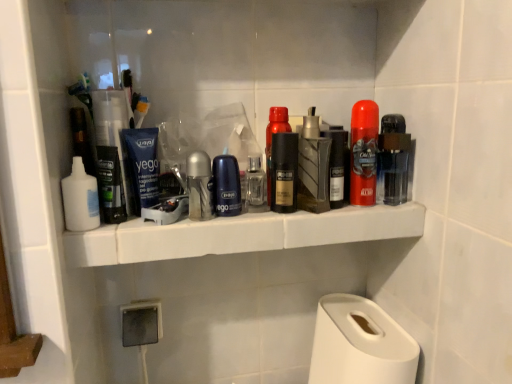
Question: Which direction should I rotate to look at clear glass spray bottle at center, acting as the 2th toiletry starting from the right?

Choices:
 (A) right
 (B) left

Answer: (A)

Question: Can you confirm if shiny red can at center, which is counted as the 7th personal care, starting from the left, is taller than white matte lotion at left, acting as the first toiletry starting from the left?

Choices:
 (A) no
 (B) yes

Answer: (B)

Question: Does shiny red can at center, the second personal care in the right-to-left sequence, have a smaller size compared to white matte lotion at left, acting as the first toiletry starting from the left?

Choices:
 (A) yes
 (B) no

Answer: (B)

Question: Is shiny red can at center, which is counted as the 7th personal care, starting from the left, located outside white matte lotion at left, the fourth toiletry positioned from the right?

Choices:
 (A) no
 (B) yes

Answer: (B)

Question: Does shiny red can at center, the second personal care in the right-to-left sequence, have a greater width compared to white matte lotion at left, acting as the first toiletry starting from the left?

Choices:
 (A) yes
 (B) no

Answer: (B)

Question: Is shiny red can at center, the second personal care in the right-to-left sequence, at the right side of white matte lotion at left, the fourth toiletry positioned from the right?

Choices:
 (A) no
 (B) yes

Answer: (B)

Question: Is shiny red can at center, the second personal care in the right-to-left sequence, turned away from white matte lotion at left, the fourth toiletry positioned from the right?

Choices:
 (A) yes
 (B) no

Answer: (B)

Question: From the image's perspective, is metallic gold can at center, placed as the 4th personal care when sorted from left to right, above metallic silver deodorant at center, arranged as the 3th toiletry when viewed from the right?

Choices:
 (A) no
 (B) yes

Answer: (B)

Question: Does metallic gold can at center, placed as the 4th personal care when sorted from left to right, touch metallic silver deodorant at center, the second toiletry when ordered from left to right?

Choices:
 (A) no
 (B) yes

Answer: (A)

Question: Can you confirm if metallic gold can at center, the fifth personal care in the right-to-left sequence, is thinner than metallic silver deodorant at center, the second toiletry when ordered from left to right?

Choices:
 (A) yes
 (B) no

Answer: (A)

Question: Is metallic gold can at center, the fifth personal care in the right-to-left sequence, oriented away from metallic silver deodorant at center, arranged as the 3th toiletry when viewed from the right?

Choices:
 (A) yes
 (B) no

Answer: (B)

Question: Is the depth of metallic gold can at center, placed as the 4th personal care when sorted from left to right, greater than that of metallic silver deodorant at center, the second toiletry when ordered from left to right?

Choices:
 (A) yes
 (B) no

Answer: (A)

Question: Considering the relative positions of metallic gold can at center, the fifth personal care in the right-to-left sequence, and metallic silver deodorant at center, arranged as the 3th toiletry when viewed from the right, in the image provided, is metallic gold can at center, the fifth personal care in the right-to-left sequence, to the left of metallic silver deodorant at center, arranged as the 3th toiletry when viewed from the right, from the viewer's perspective?

Choices:
 (A) yes
 (B) no

Answer: (B)

Question: Is metallic silver deodorant at center, arranged as the 3th toiletry when viewed from the right, shorter than white matte paper towel at lower right?

Choices:
 (A) no
 (B) yes

Answer: (B)